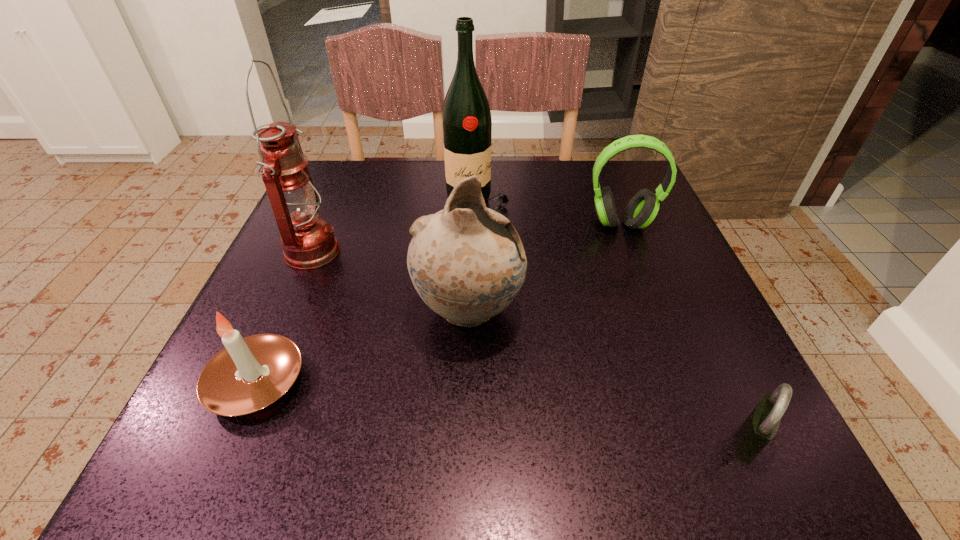
Image resolution: width=960 pixels, height=540 pixels. I want to click on free space located on the back of the candle, so (x=297, y=289).

The width and height of the screenshot is (960, 540). What are the coordinates of `vacant position located 0.250m on the left of the padlock` in the screenshot? It's located at (544, 440).

The width and height of the screenshot is (960, 540). Identify the location of wine bottle positioned at the far edge. (466, 118).

Locate an element on the screen. The image size is (960, 540). headset that is at the far edge is located at coordinates (643, 207).

Locate an element on the screen. This screenshot has height=540, width=960. candle that is at the near edge is located at coordinates (249, 374).

At what (x,y) coordinates should I click in order to perform the action: click on padlock at the near edge. Please return your answer as a coordinate pair (x, y). The image size is (960, 540). Looking at the image, I should click on (761, 425).

Where is `oil lamp that is at the left edge`? Image resolution: width=960 pixels, height=540 pixels. oil lamp that is at the left edge is located at coordinates (308, 241).

The height and width of the screenshot is (540, 960). In order to click on candle at the left edge in this screenshot , I will do `click(249, 374)`.

Locate an element on the screen. This screenshot has width=960, height=540. headset positioned at the right edge is located at coordinates (643, 207).

Locate an element on the screen. The width and height of the screenshot is (960, 540). padlock present at the right edge is located at coordinates (761, 425).